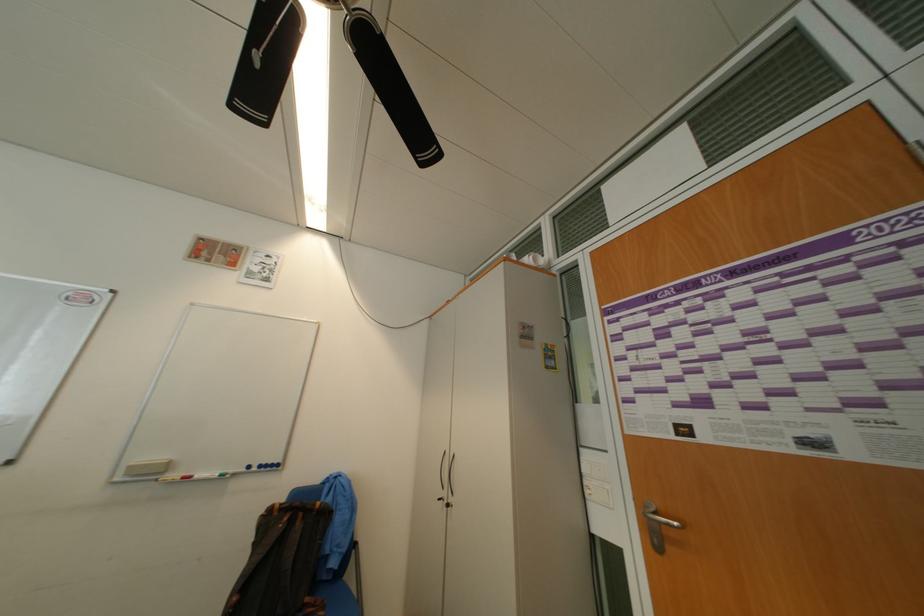
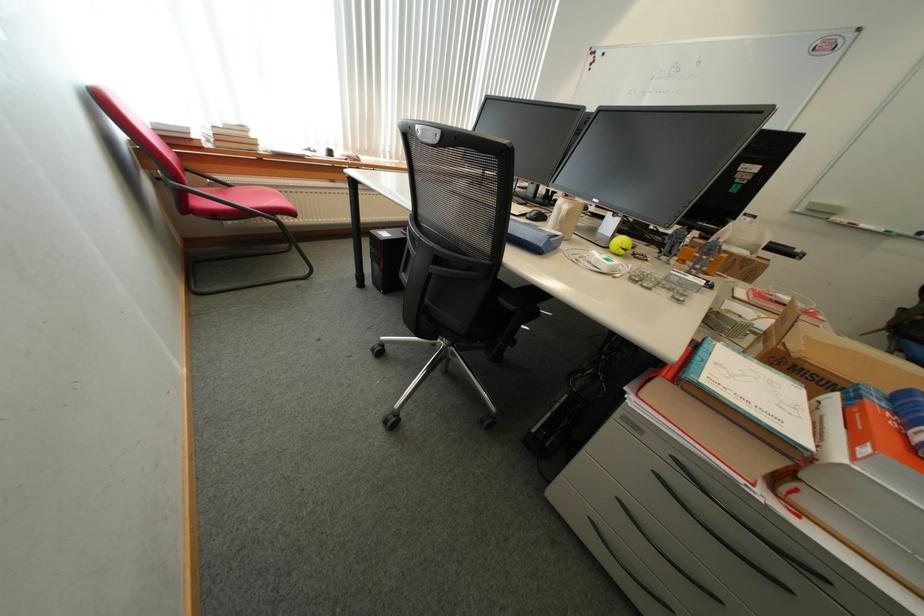
Locate, in the second image, the point that corresponds to point (200, 477) in the first image.

(861, 225)